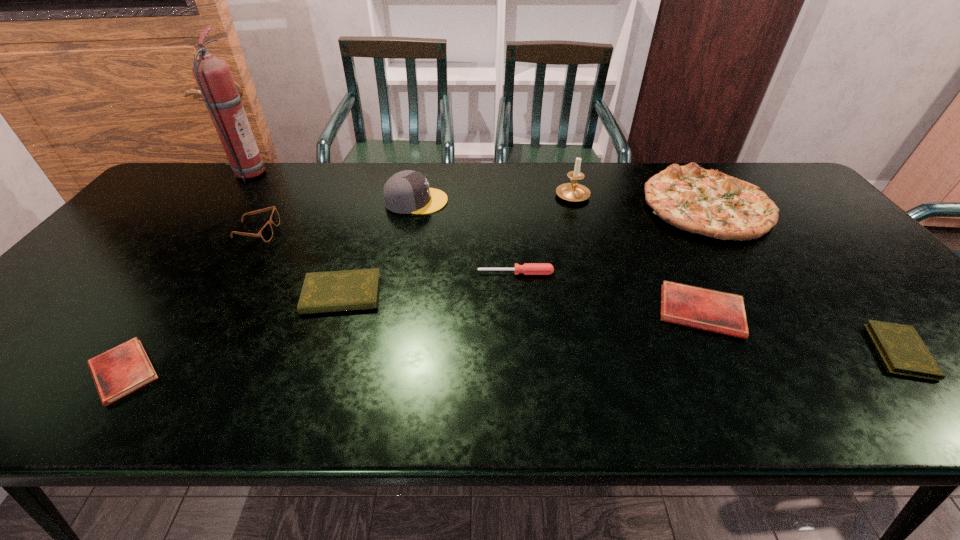
Where is `free space located 0.390m on the back of the shortest object`? Image resolution: width=960 pixels, height=540 pixels. free space located 0.390m on the back of the shortest object is located at coordinates (222, 233).

In order to click on fire extinguisher that is at the far edge in this screenshot , I will do `click(213, 76)`.

At what (x,y) coordinates should I click in order to perform the action: click on candle holder at the far edge. Please return your answer as a coordinate pair (x, y). The width and height of the screenshot is (960, 540). Looking at the image, I should click on (573, 191).

Where is `cap located in the far edge section of the desktop`? cap located in the far edge section of the desktop is located at coordinates (407, 191).

At what (x,y) coordinates should I click in order to perform the action: click on pizza at the far edge. Please return your answer as a coordinate pair (x, y). Looking at the image, I should click on (707, 202).

You are a GUI agent. You are given a task and a screenshot of the screen. Output one action in this format:
    pyautogui.click(x=<x>, y=<y>)
    Task: Click on the pizza at the right edge
    
    Given the screenshot: What is the action you would take?
    pyautogui.click(x=707, y=202)

This screenshot has width=960, height=540. Identify the location of diary located at the right edge. (902, 349).

This screenshot has width=960, height=540. I want to click on object positioned at the far right corner, so (x=707, y=202).

The height and width of the screenshot is (540, 960). In order to click on object at the near right corner in this screenshot , I will do `click(902, 349)`.

Identify the location of free region at the far edge of the desktop. This screenshot has width=960, height=540. (703, 164).